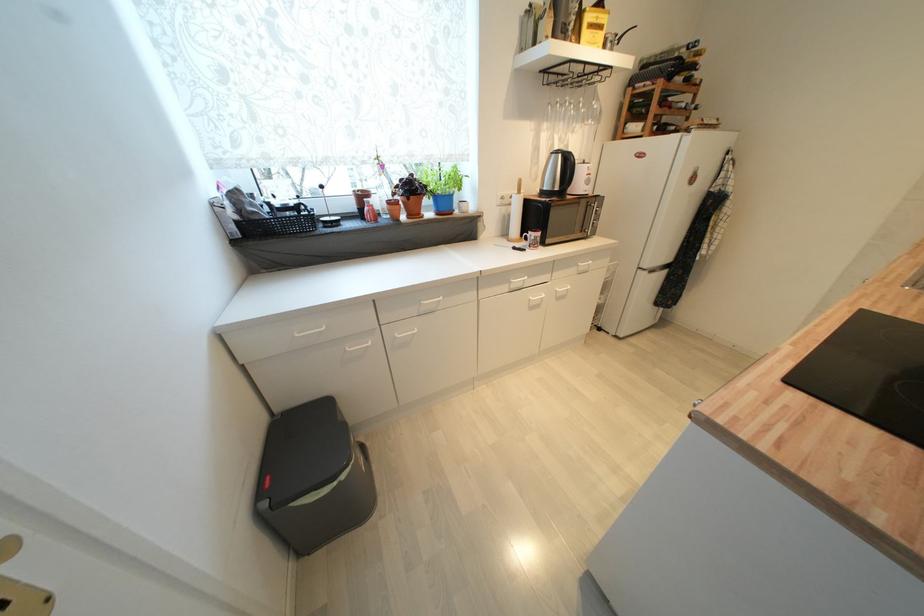
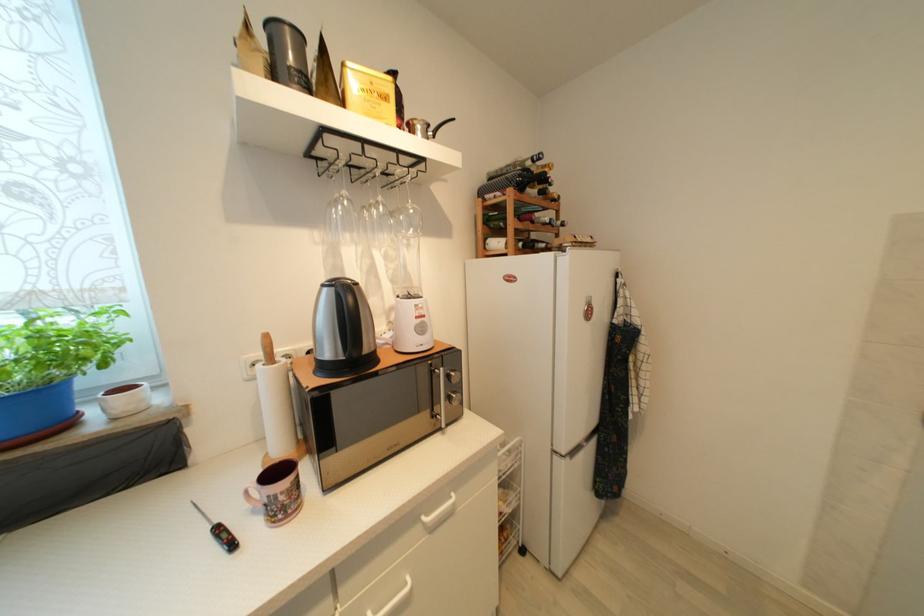
Find the pixel in the second image that matches point 684,81 in the first image.

(538, 193)